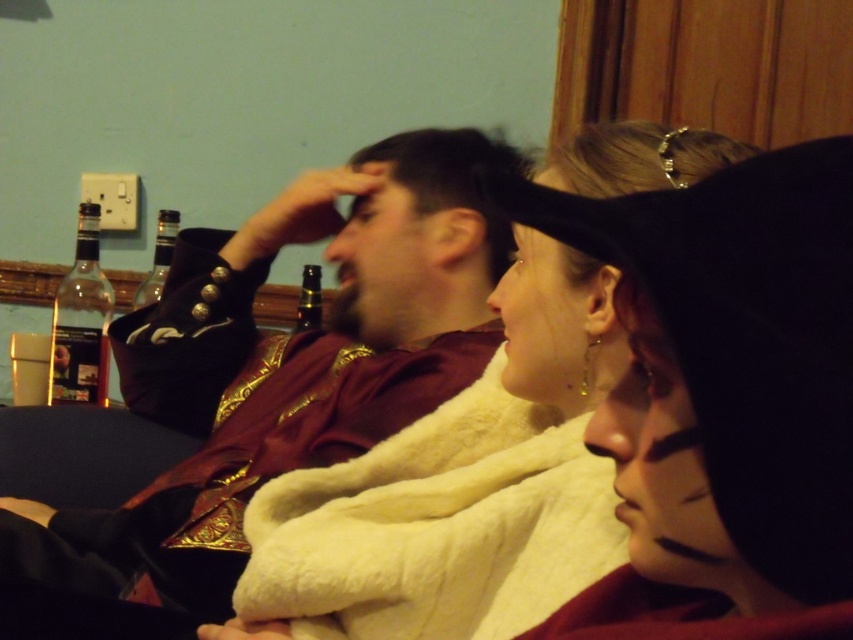
Who is positioned more to the right, matte brown hair at center or black felt hat at upper center?

black felt hat at upper center

Is matte brown hair at center positioned before black felt hat at upper center?

No.

Is point (434, 333) behind point (662, 150)?

Yes, point (434, 333) is farther from viewer.

Where is `matte brown hair at center`? This screenshot has width=853, height=640. matte brown hair at center is located at coordinates [x=419, y=236].

Can you confirm if white fluffy blanket at center is positioned below matte brown hair at center?

Indeed, white fluffy blanket at center is positioned under matte brown hair at center.

Does white fluffy blanket at center lie behind matte brown hair at center?

No, it is in front of matte brown hair at center.

What do you see at coordinates (460, 486) in the screenshot? I see `white fluffy blanket at center` at bounding box center [460, 486].

Locate an element on the screen. white fluffy blanket at center is located at coordinates (460, 486).

Based on the photo, between velvet maroon robe at center and white fluffy coat at center, which one is positioned lower?

white fluffy coat at center is lower down.

Is velvet maroon robe at center taller than white fluffy coat at center?

Correct, velvet maroon robe at center is much taller as white fluffy coat at center.

Locate an element on the screen. velvet maroon robe at center is located at coordinates (285, 364).

Find the location of a particular element. velvet maroon robe at center is located at coordinates (285, 364).